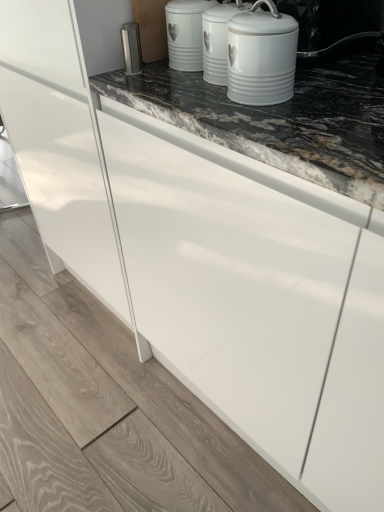
Question: Can you confirm if white ceramic canister at upper center is bigger than satin silver canister at upper center?

Choices:
 (A) no
 (B) yes

Answer: (B)

Question: Does white ceramic canister at upper center appear on the right side of satin silver canister at upper center?

Choices:
 (A) no
 (B) yes

Answer: (B)

Question: Considering the relative sizes of white ceramic canister at upper center and satin silver canister at upper center in the image provided, is white ceramic canister at upper center smaller than satin silver canister at upper center?

Choices:
 (A) yes
 (B) no

Answer: (B)

Question: Could satin silver canister at upper center be considered to be inside white ceramic canister at upper center?

Choices:
 (A) no
 (B) yes

Answer: (A)

Question: Can you confirm if white ceramic canister at upper center is shorter than satin silver canister at upper center?

Choices:
 (A) no
 (B) yes

Answer: (A)

Question: Is white ceramic canister at upper center completely or partially outside of satin silver canister at upper center?

Choices:
 (A) no
 (B) yes

Answer: (B)

Question: Would you consider white ceramic canister at upper center to be distant from white ceramic canister at upper center?

Choices:
 (A) no
 (B) yes

Answer: (A)

Question: Is white ceramic canister at upper center further to camera compared to white ceramic canister at upper center?

Choices:
 (A) yes
 (B) no

Answer: (A)

Question: Is white ceramic canister at upper center a part of white ceramic canister at upper center?

Choices:
 (A) no
 (B) yes

Answer: (A)

Question: From a real-world perspective, is white ceramic canister at upper center positioned under white ceramic canister at upper center based on gravity?

Choices:
 (A) no
 (B) yes

Answer: (B)

Question: Can you confirm if white ceramic canister at upper center is taller than white ceramic canister at upper center?

Choices:
 (A) yes
 (B) no

Answer: (B)

Question: Does white ceramic canister at upper center have a lesser height compared to white ceramic canister at upper center?

Choices:
 (A) yes
 (B) no

Answer: (A)

Question: Is the position of satin silver canister at upper center less distant than that of white ceramic canister at upper center?

Choices:
 (A) no
 (B) yes

Answer: (A)